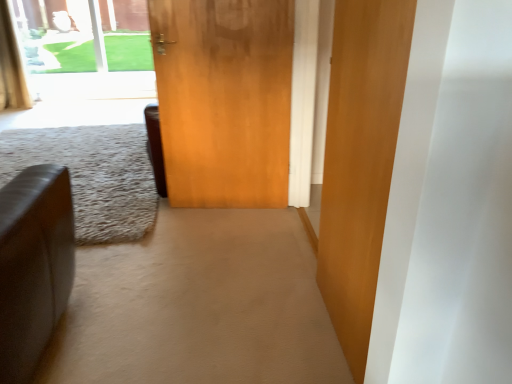
Question: Considering the relative sizes of transparent glass window at upper left and gold textured curtain at upper left in the image provided, is transparent glass window at upper left wider than gold textured curtain at upper left?

Choices:
 (A) no
 (B) yes

Answer: (A)

Question: From a real-world perspective, is transparent glass window at upper left positioned under gold textured curtain at upper left based on gravity?

Choices:
 (A) yes
 (B) no

Answer: (B)

Question: Are transparent glass window at upper left and gold textured curtain at upper left beside each other?

Choices:
 (A) no
 (B) yes

Answer: (A)

Question: From the image's perspective, is transparent glass window at upper left over gold textured curtain at upper left?

Choices:
 (A) yes
 (B) no

Answer: (A)

Question: Does transparent glass window at upper left appear on the left side of gold textured curtain at upper left?

Choices:
 (A) yes
 (B) no

Answer: (B)

Question: Is transparent glass window at upper left thinner than gold textured curtain at upper left?

Choices:
 (A) yes
 (B) no

Answer: (A)

Question: Is wooden door at center, acting as the 2th door starting from the left, taller than leather couch at left?

Choices:
 (A) yes
 (B) no

Answer: (A)

Question: Is the depth of wooden door at center, acting as the 2th door starting from the left, less than that of leather couch at left?

Choices:
 (A) yes
 (B) no

Answer: (A)

Question: Is wooden door at center, which is the 1th door in right-to-left order, shorter than leather couch at left?

Choices:
 (A) yes
 (B) no

Answer: (B)

Question: From the image's perspective, is wooden door at center, acting as the 2th door starting from the left, over leather couch at left?

Choices:
 (A) yes
 (B) no

Answer: (B)

Question: Is wooden door at center, acting as the first door starting from the front, placed right next to leather couch at left?

Choices:
 (A) no
 (B) yes

Answer: (A)

Question: Could you tell me if wooden door at center, acting as the 2th door starting from the left, is facing leather couch at left?

Choices:
 (A) no
 (B) yes

Answer: (A)

Question: Does wooden door at center, acting as the 2th door starting from the front, have a larger size compared to leather couch at left?

Choices:
 (A) yes
 (B) no

Answer: (B)